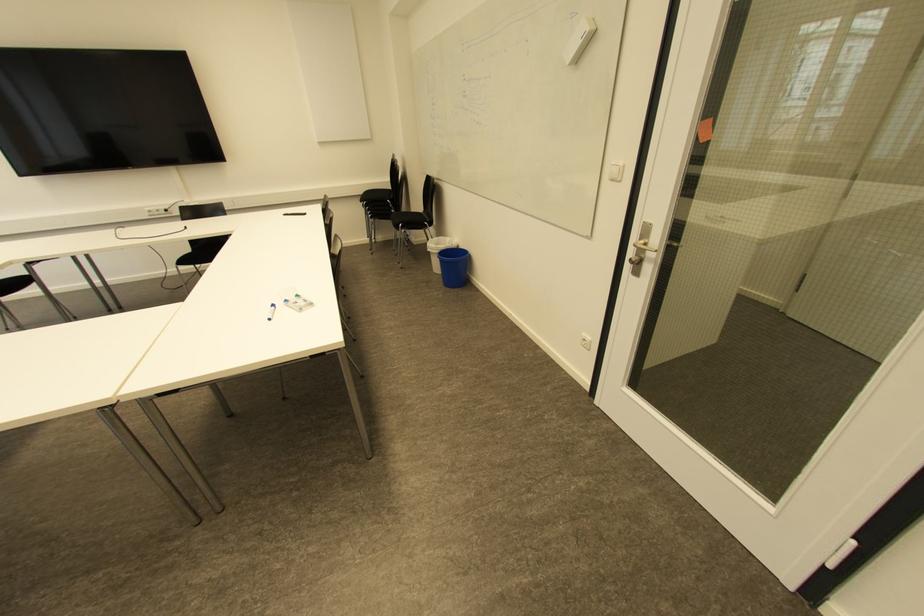
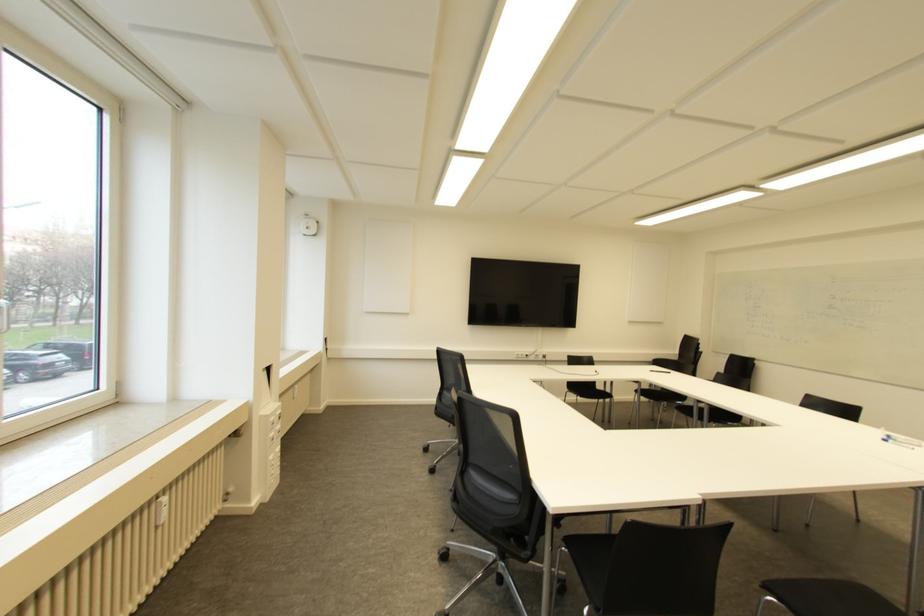
Question: I am providing you with two images of the same scene from different viewpoints. Please identify which objects are invisible in image2.

Choices:
 (A) blue whiteboard marker
 (B) black chair sitting surface
 (C) white power outlet
 (D) white shower ring

Answer: (B)